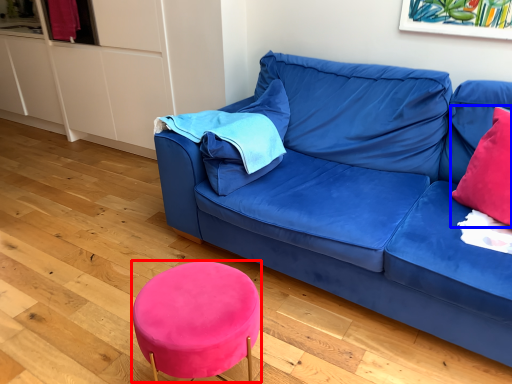
Question: Which of the following is the farthest to the observer, bar stool (highlighted by a red box) or throw pillow (highlighted by a blue box)?

Choices:
 (A) bar stool
 (B) throw pillow

Answer: (B)